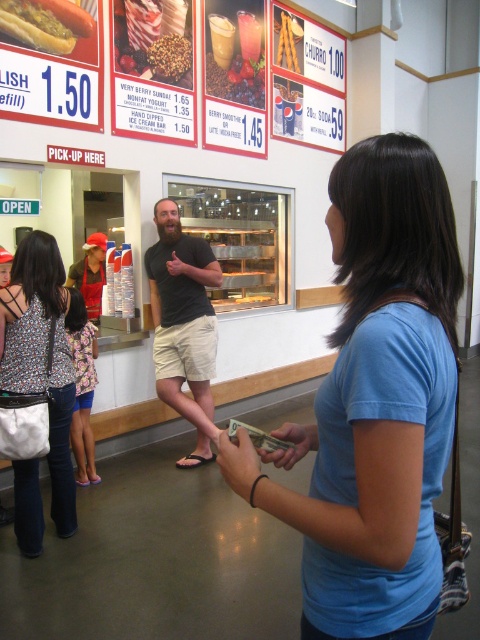
Question: Is smoothie cup at center wider than matte hot dog at center?

Choices:
 (A) yes
 (B) no

Answer: (A)

Question: Is blue cotton shirt at center below smooth brown granola at center?

Choices:
 (A) no
 (B) yes

Answer: (B)

Question: Among these points, which one is farthest from the camera?

Choices:
 (A) (151, 52)
 (B) (190, 45)
 (C) (85, 253)

Answer: (C)

Question: From the image, what is the correct spatial relationship of blue cotton shirt at center in relation to floral fabric tank top at center?

Choices:
 (A) above
 (B) below

Answer: (A)

Question: Among these points, which one is farthest from the camera?

Choices:
 (A) (1, 1)
 (B) (96, 269)

Answer: (B)

Question: Which is nearer to the smooth chocolate bar at center?

Choices:
 (A) matte hot dog at center
 (B) smooth brown granola at center
 (C) smoothie cup at center
 (D) black cotton shirt at center

Answer: (B)